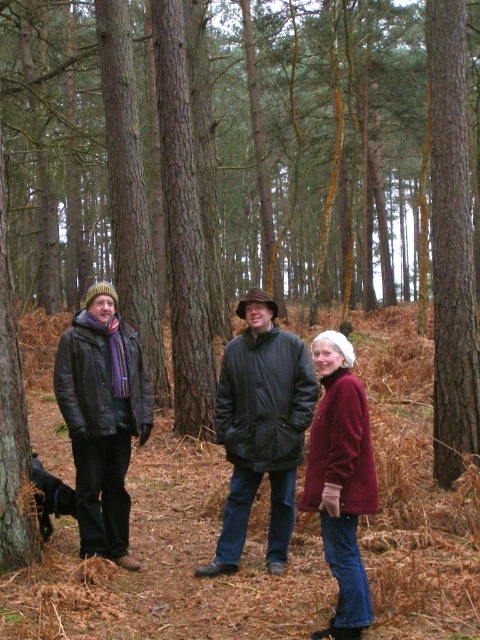
Between point (332, 548) and point (0, 332), which one is positioned in front?

Point (332, 548)

Is point (350, 544) closer to viewer compared to point (23, 490)?

That is True.

Find the location of a particular element. The width and height of the screenshot is (480, 640). maroon fleece jacket at center is located at coordinates (340, 481).

Can you confirm if brown rough bark tree at center right is wider than leather jacket at left?

In fact, brown rough bark tree at center right might be narrower than leather jacket at left.

Who is lower down, brown rough bark tree at center right or leather jacket at left?

leather jacket at left is lower down.

Which is in front, point (456, 348) or point (113, 342)?

Positioned in front is point (113, 342).

I want to click on brown rough bark tree at center right, so click(x=451, y=244).

Looking at this image, can you confirm if matte black jacket at center is shorter than leather jacket at left?

Yes, matte black jacket at center is shorter than leather jacket at left.

Who is positioned more to the right, matte black jacket at center or leather jacket at left?

matte black jacket at center

Describe the element at coordinates (261, 428) in the screenshot. I see `matte black jacket at center` at that location.

Locate an element on the screen. matte black jacket at center is located at coordinates (261, 428).